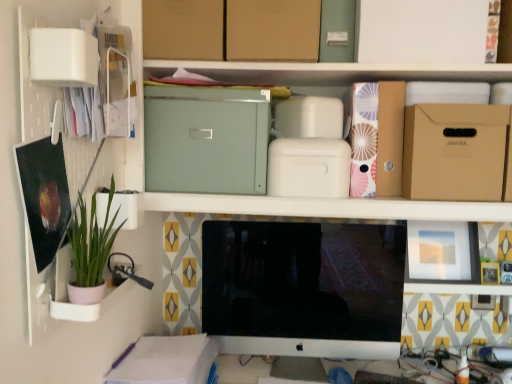
Question: From the image's perspective, relative to brown cardboard box at upper center, which is the third cardboard box from left to right, is brown cardboard box at upper center, acting as the 5th cardboard box starting from the right, above or below?

Choices:
 (A) below
 (B) above

Answer: (B)

Question: Looking at their shapes, would you say brown cardboard box at upper center, acting as the 5th cardboard box starting from the right, is wider or thinner than brown cardboard box at upper center, which is the third cardboard box from left to right?

Choices:
 (A) thin
 (B) wide

Answer: (B)

Question: Which object is positioned closest to the sleek silver monitor at center?

Choices:
 (A) green matte plant at left
 (B) brown cardboard box at upper center, acting as the 5th cardboard box starting from the right
 (C) brown cardboard box at right, which is the 5th cardboard box in left-to-right order
 (D) brown cardboard box at upper right, acting as the fourth cardboard box starting from the left
 (E) matte green metal file cabinet at upper center, the second cardboard box from the left

Answer: (E)

Question: Estimate the real-world distances between objects in this image. Which object is closer to the white plastic cabinet at upper left?

Choices:
 (A) matte green metal file cabinet at upper center
 (B) brown cardboard box at right, which appears as the 1th cardboard box when viewed from the right
 (C) green matte plant at left
 (D) brown cardboard box at upper right, acting as the fourth cardboard box starting from the left
 (E) matte green metal file cabinet at upper center, the 4th cardboard box positioned from the right

Answer: (C)